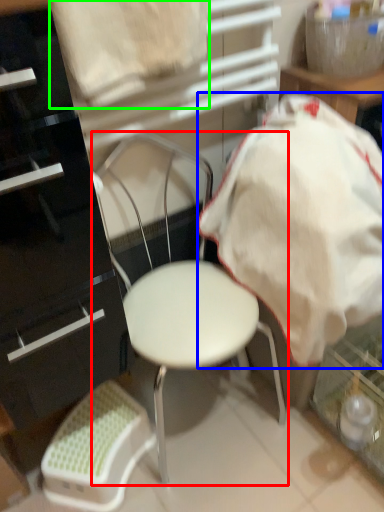
Question: Based on their relative distances, which object is farther from chair (highlighted by a red box)? Choose from blanket (highlighted by a blue box) and sheet (highlighted by a green box).

Choices:
 (A) blanket
 (B) sheet

Answer: (B)